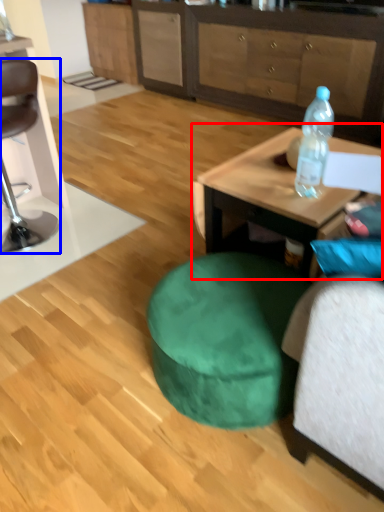
Question: Which object is further to the camera taking this photo, coffee table (highlighted by a red box) or chair (highlighted by a blue box)?

Choices:
 (A) coffee table
 (B) chair

Answer: (B)